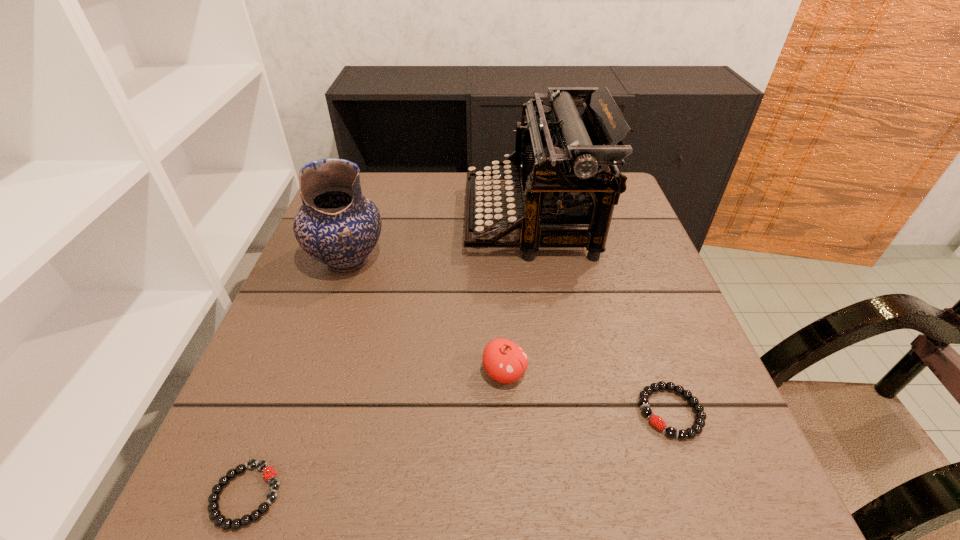
You are a GUI agent. You are given a task and a screenshot of the screen. Output one action in this format:
    pyautogui.click(x=<x>, y=<y>)
    Task: Click on the free space between the farther bracelet and the third shortest object
    
    Given the screenshot: What is the action you would take?
    pyautogui.click(x=588, y=393)

The height and width of the screenshot is (540, 960). Identify the location of unoccupied position between the right bracelet and the third shortest object. (588, 393).

Find the location of a particular element. vacant space that is in between the right bracelet and the tallest object is located at coordinates (601, 316).

This screenshot has height=540, width=960. In order to click on free space that is in between the third tallest object and the nearer bracelet in this screenshot , I will do `click(375, 434)`.

At what (x,y) coordinates should I click in order to perform the action: click on free space between the tallest object and the right bracelet. Please return your answer as a coordinate pair (x, y). Looking at the image, I should click on (601, 316).

The image size is (960, 540). I want to click on blank region between the left bracelet and the typewriter, so click(389, 357).

This screenshot has height=540, width=960. What are the coordinates of `the fourth closest object to the fourth shortest object` in the screenshot? It's located at (699, 422).

Where is `object that stands as the closest to the farther bracelet`? object that stands as the closest to the farther bracelet is located at coordinates (504, 361).

The image size is (960, 540). I want to click on vacant area in the image that satisfies the following two spatial constraints: 1. on the typing side of the typewriter; 2. on the front side of the pottery, so click(537, 261).

At what (x,y) coordinates should I click in order to perform the action: click on vacant space that satisfies the following two spatial constraints: 1. on the typing side of the typewriter; 2. on the left side of the right bracelet. Please return your answer as a coordinate pair (x, y). The height and width of the screenshot is (540, 960). Looking at the image, I should click on (560, 412).